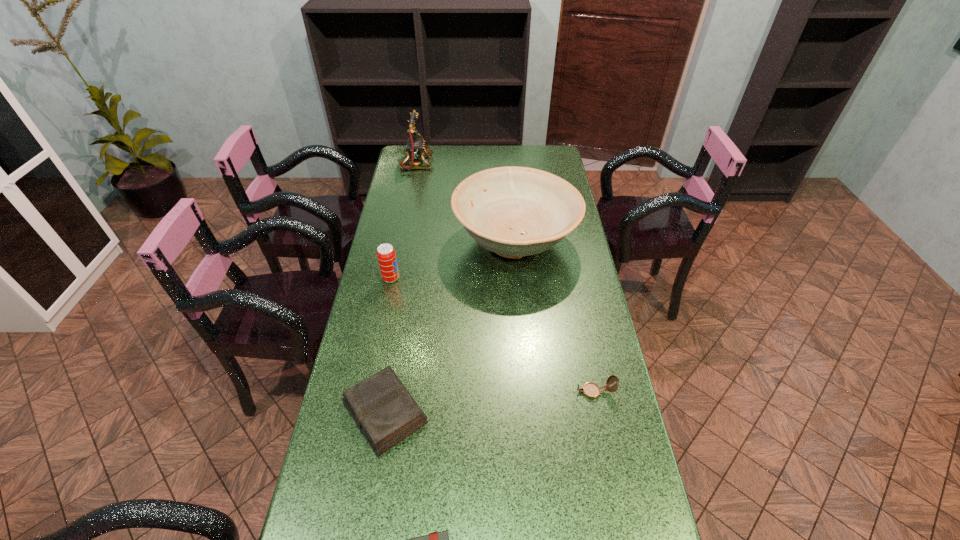
You are a GUI agent. You are given a task and a screenshot of the screen. Output one action in this format:
    pyautogui.click(x=<x>, y=<y>)
    Task: Click on the free space located on the face of the compass
    
    Given the screenshot: What is the action you would take?
    pyautogui.click(x=469, y=392)

I want to click on vacant space located 0.060m on the face of the compass, so click(x=551, y=392).

Find the location of a particular element. The height and width of the screenshot is (540, 960). vacant space located 0.080m on the right of the farther book is located at coordinates (461, 413).

Find the location of a particular element. This screenshot has height=540, width=960. object that is at the far edge is located at coordinates (415, 147).

Image resolution: width=960 pixels, height=540 pixels. What are the coordinates of `telephone present at the left edge` in the screenshot? It's located at (415, 147).

Find the location of a particular element. The width and height of the screenshot is (960, 540). soda can that is at the left edge is located at coordinates (386, 255).

Where is `book located at the left edge`? The height and width of the screenshot is (540, 960). book located at the left edge is located at coordinates (385, 412).

You are a GUI agent. You are given a task and a screenshot of the screen. Output one action in this format:
    pyautogui.click(x=<x>, y=<y>)
    Task: Click on the dish present at the right edge
    The height and width of the screenshot is (540, 960).
    Given the screenshot: What is the action you would take?
    pyautogui.click(x=512, y=211)

The image size is (960, 540). I want to click on compass at the right edge, so [591, 390].

Image resolution: width=960 pixels, height=540 pixels. I want to click on object located at the far left corner, so click(415, 147).